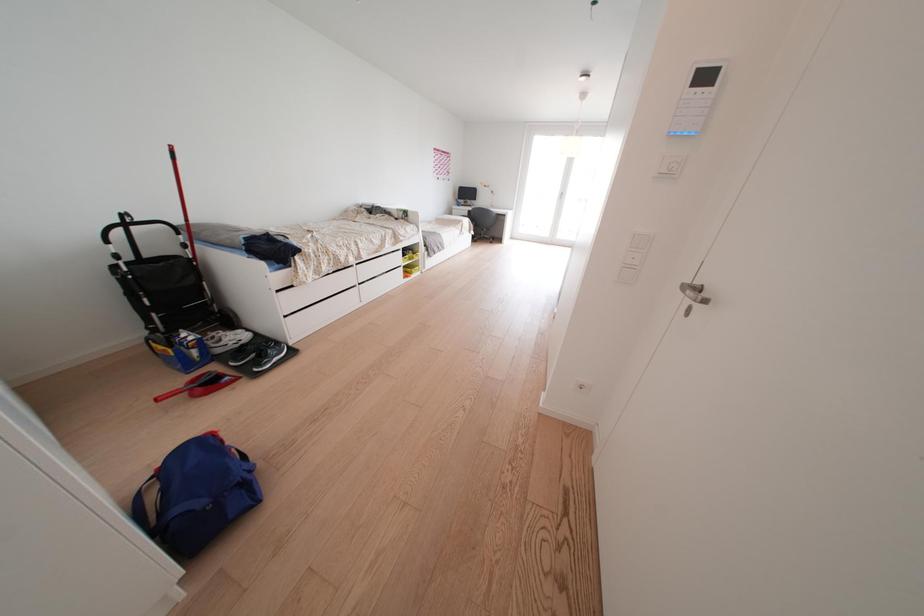
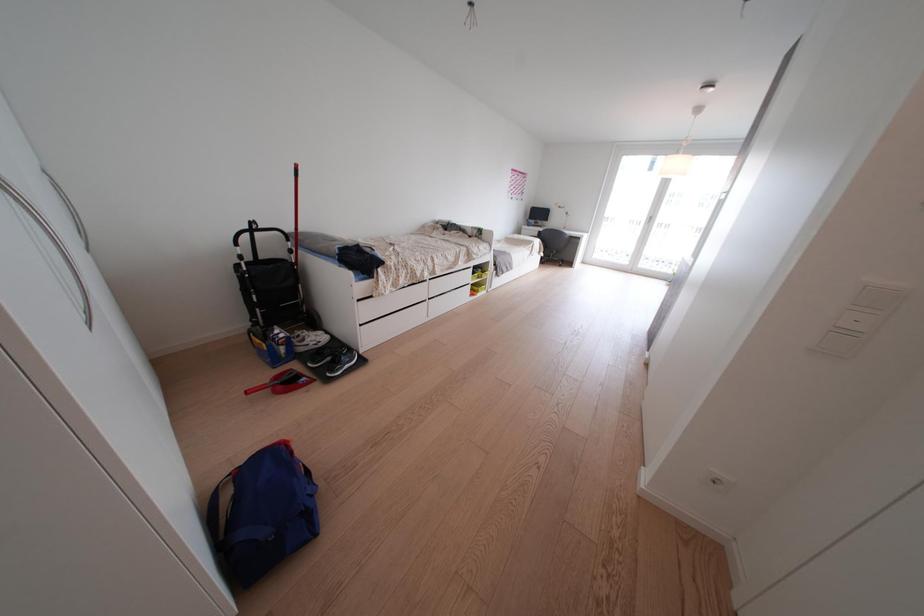
Question: The camera is either moving clockwise (left) or counter-clockwise (right) around the object. The first image is from the beginning of the video and the second image is from the end. Is the camera moving left or right when shooting the video?

Choices:
 (A) Left
 (B) Right

Answer: (B)